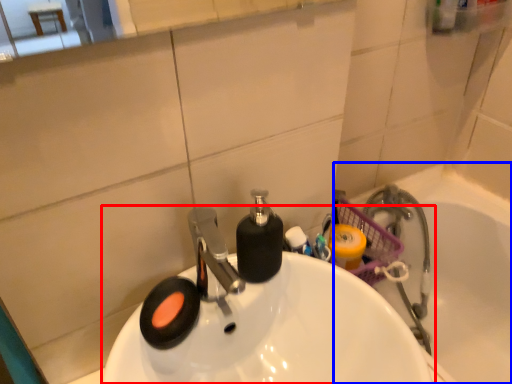
Question: Which of the following is the farthest to the observer, sink (highlighted by a red box) or bath (highlighted by a blue box)?

Choices:
 (A) sink
 (B) bath

Answer: (B)